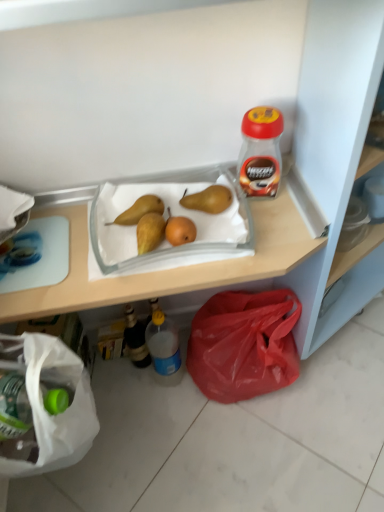
Identify the location of free spot to the right of red plastic bag at lower right. (344, 375).